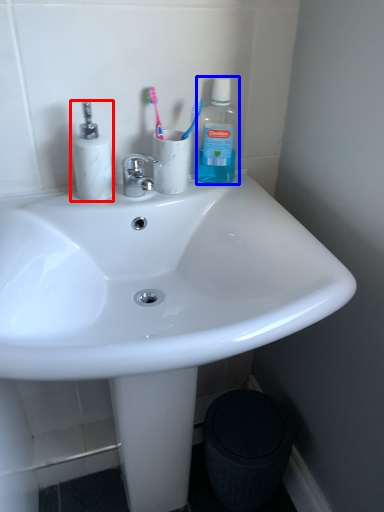
Question: Which object is closer to the camera taking this photo, toiletries (highlighted by a red box) or bottle (highlighted by a blue box)?

Choices:
 (A) toiletries
 (B) bottle

Answer: (A)